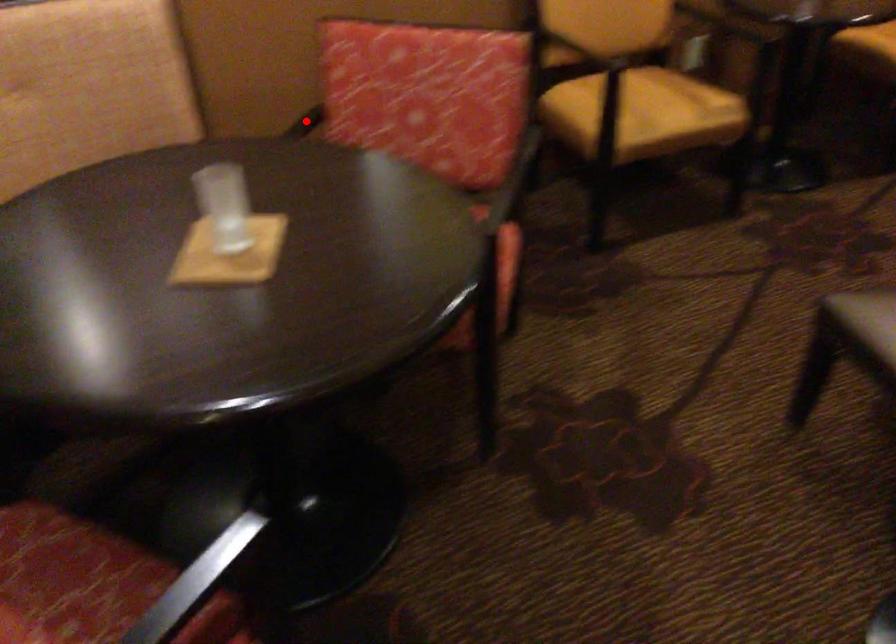
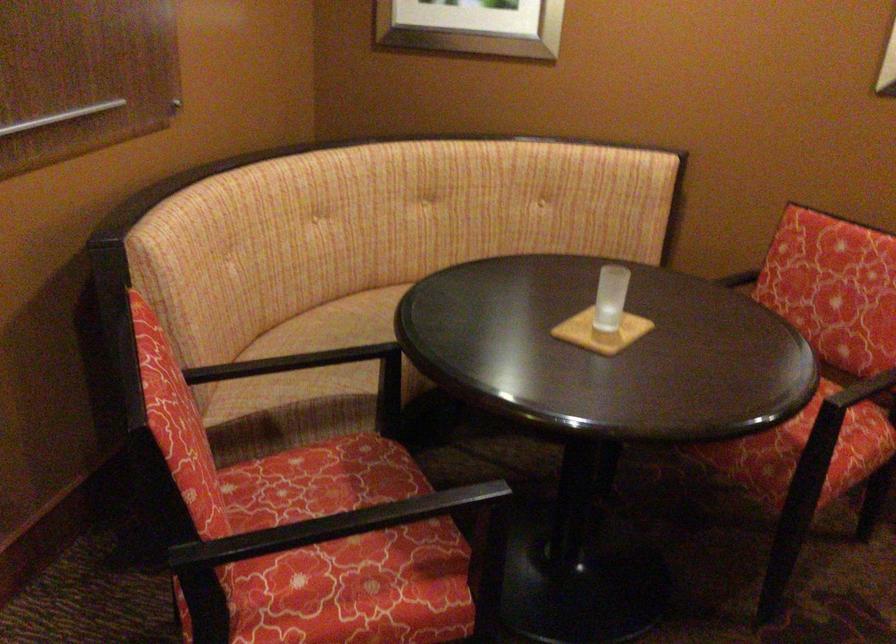
Question: I am providing you with two images of the same scene from different viewpoints. Image1 has a red point marked. In image2, the corresponding 3D location appears at what relative position? Reply with the corresponding letter.

Choices:
 (A) Closer
 (B) Farther

Answer: (B)